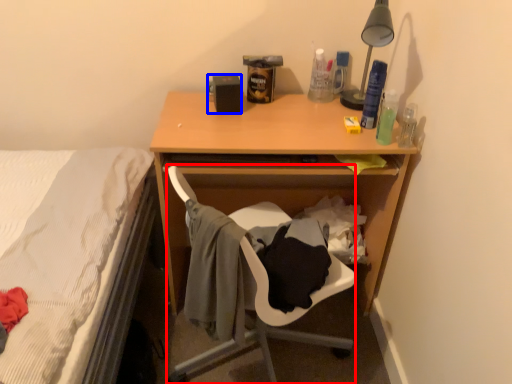
Question: Which of the following is the closest to the observer, chair (highlighted by a red box) or loudspeaker (highlighted by a blue box)?

Choices:
 (A) chair
 (B) loudspeaker

Answer: (A)